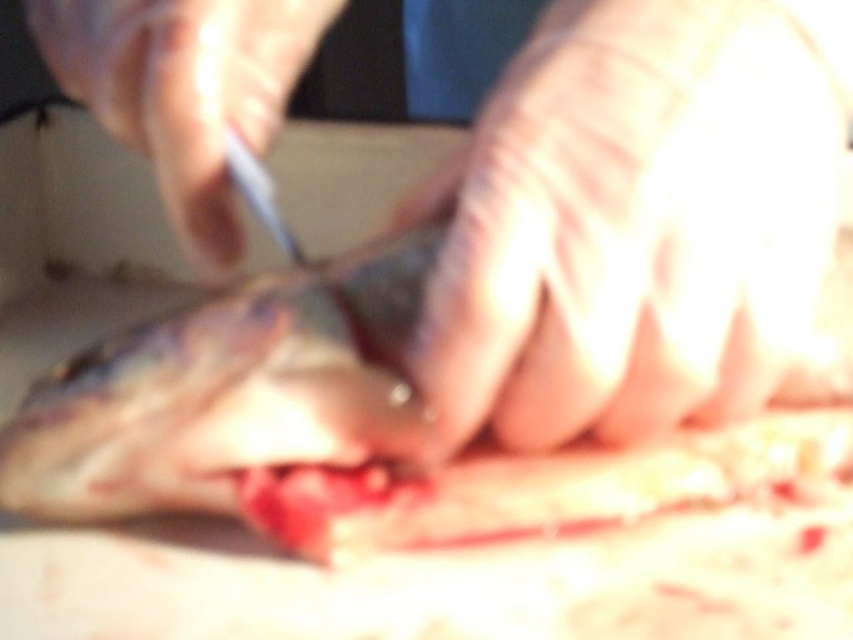
You are a surgeon performing a procedure on a fish. You need to reach a specific point marked at coordinates point (380, 280). If your hand is currently 10 inches away from the fish, should you move your hand closer or farther away to reach that point?

The distance of point (380, 280) from viewer is 12.79 inches. Since your hand is currently 10 inches away, you need to move your hand closer to reach the point.

You are a medical student observing a fish surgery. You notice two points marked in the image. One is at coordinates point (x=654, y=321) and the other at point (x=78, y=80). Which point is closer to you?

Point (x=654, y=321) is closer to the viewer than point (x=78, y=80).